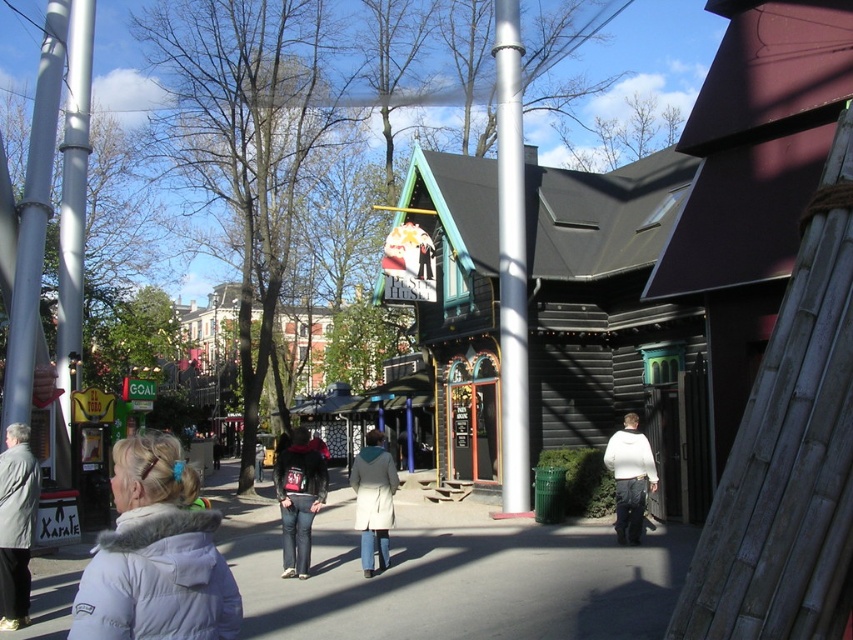
Image resolution: width=853 pixels, height=640 pixels. What do you see at coordinates (457, 577) in the screenshot?
I see `smooth concrete pavement at center` at bounding box center [457, 577].

Where is `smooth concrete pavement at center`? smooth concrete pavement at center is located at coordinates (457, 577).

Does smooth concrete pavement at center have a lesser height compared to light beige coat at center?

Yes.

This screenshot has height=640, width=853. I want to click on smooth concrete pavement at center, so click(x=457, y=577).

Consider the image. Can you confirm if black wooden building at center is bigger than white fuzzy coat at lower left?

Yes, black wooden building at center is bigger than white fuzzy coat at lower left.

From the picture: Can you confirm if black wooden building at center is taller than white fuzzy coat at lower left?

Yes, black wooden building at center is taller than white fuzzy coat at lower left.

What are the coordinates of `black wooden building at center` in the screenshot? It's located at (602, 304).

Where is `black wooden building at center`? The image size is (853, 640). black wooden building at center is located at coordinates (602, 304).